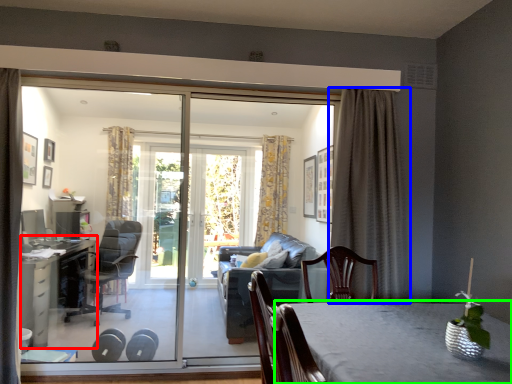
Question: Which is nearer to the table (highlighted by a red box)? curtain (highlighted by a blue box) or table (highlighted by a green box).

Choices:
 (A) curtain
 (B) table

Answer: (A)